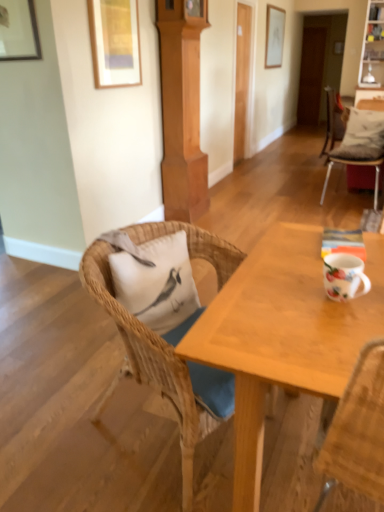
Question: From the image's perspective, is white glossy mug at right beneath matte white picture frame at upper center, which ranks as the 3th picture frame in left-to-right order?

Choices:
 (A) yes
 (B) no

Answer: (A)

Question: Is white glossy mug at right to the right of matte white picture frame at upper center, arranged as the first picture frame when viewed from the right, from the viewer's perspective?

Choices:
 (A) yes
 (B) no

Answer: (B)

Question: Does white glossy mug at right turn towards matte white picture frame at upper center, which is counted as the 3th picture frame, starting from the front?

Choices:
 (A) no
 (B) yes

Answer: (B)

Question: Considering the relative sizes of white glossy mug at right and matte white picture frame at upper center, the 1th picture frame in the top-to-bottom sequence, in the image provided, is white glossy mug at right smaller than matte white picture frame at upper center, the 1th picture frame in the top-to-bottom sequence,?

Choices:
 (A) no
 (B) yes

Answer: (B)

Question: Is white glossy mug at right positioned before matte white picture frame at upper center, the 1th picture frame in the top-to-bottom sequence?

Choices:
 (A) no
 (B) yes

Answer: (B)

Question: Is matte white picture frame at upper center, the 1th picture frame in the top-to-bottom sequence, completely or partially inside white glossy mug at right?

Choices:
 (A) yes
 (B) no

Answer: (B)

Question: Does white glossy mug at right have a greater width compared to white matte pillow at left, which ranks as the 1th pillow in bottom-to-top order?

Choices:
 (A) yes
 (B) no

Answer: (B)

Question: Is white matte pillow at left, the first pillow viewed from the front, located within white glossy mug at right?

Choices:
 (A) no
 (B) yes

Answer: (A)

Question: Would you say white glossy mug at right is a long distance from white matte pillow at left, acting as the 2th pillow starting from the back?

Choices:
 (A) no
 (B) yes

Answer: (A)

Question: From a real-world perspective, is white glossy mug at right on white matte pillow at left, the first pillow positioned from the left?

Choices:
 (A) no
 (B) yes

Answer: (B)

Question: From the image's perspective, would you say white glossy mug at right is positioned over white matte pillow at left, which ranks as the 1th pillow in bottom-to-top order?

Choices:
 (A) no
 (B) yes

Answer: (B)

Question: Can you confirm if white glossy mug at right is bigger than white matte pillow at left, acting as the second pillow starting from the top?

Choices:
 (A) no
 (B) yes

Answer: (A)

Question: Could you tell me if white matte pillow at left, which ranks as the 1th pillow in bottom-to-top order, is facing white cushioned chair at right, the first chair positioned from the back?

Choices:
 (A) yes
 (B) no

Answer: (B)